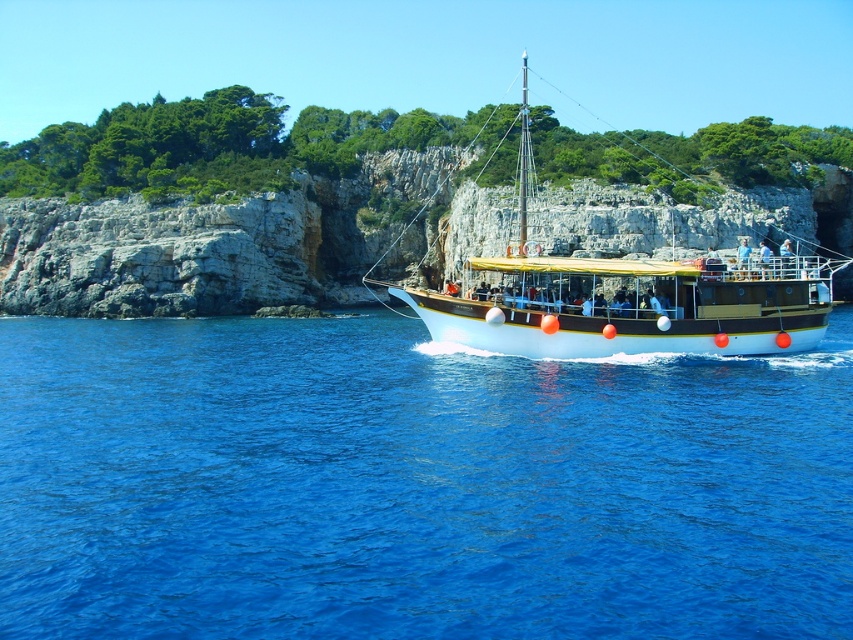
You are standing on the deck of the boat and want to reach the point marked at coordinates point (732, 608). If your maximum reach is 25 meters, can you reach it?

The point (732, 608) is 26.68 meters away from the viewer, which exceeds your maximum reach of 25 meters. Therefore, you cannot reach it.

Consider the image. You are a tourist standing on the deck of the boat and want to jump into the blue liquid water at center. The boat has a railing that is 1.5 meters high. Can you safely jump into the water from the deck without hitting the railing?

The distance between you and the blue liquid water at center is 24.62 meters. Since the railing is only 1.5 meters high, jumping from the deck would require falling 1.5 meters to reach the water. However, the description states they are 24.62 meters apart, which likely refers to horizontal distance, not vertical. Therefore, you can safely jump over the railing into the blue liquid water at center as the horizontal distance is sufficient.